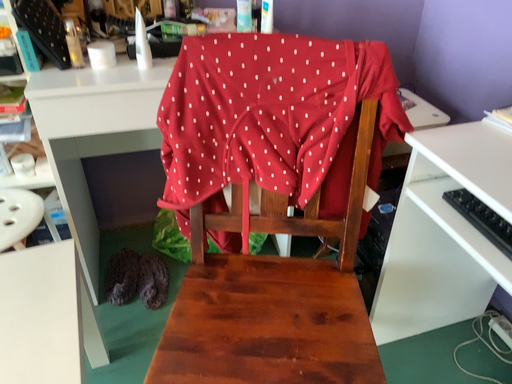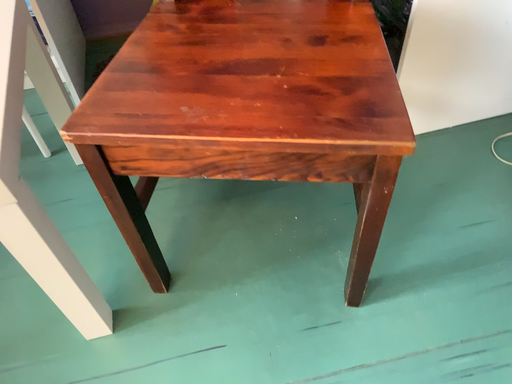
Question: How did the camera likely rotate when shooting the video?

Choices:
 (A) rotated downward
 (B) rotated upward

Answer: (A)